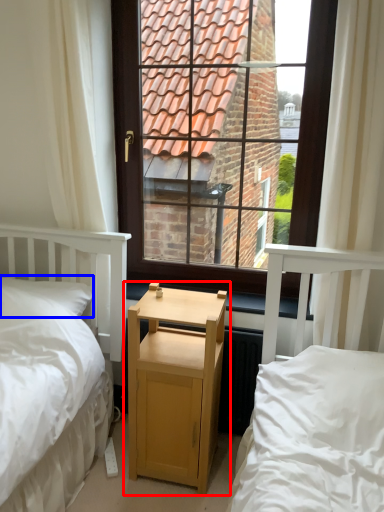
Question: Among these objects, which one is nearest to the camera, nightstand (highlighted by a red box) or pillow (highlighted by a blue box)?

Choices:
 (A) nightstand
 (B) pillow

Answer: (A)